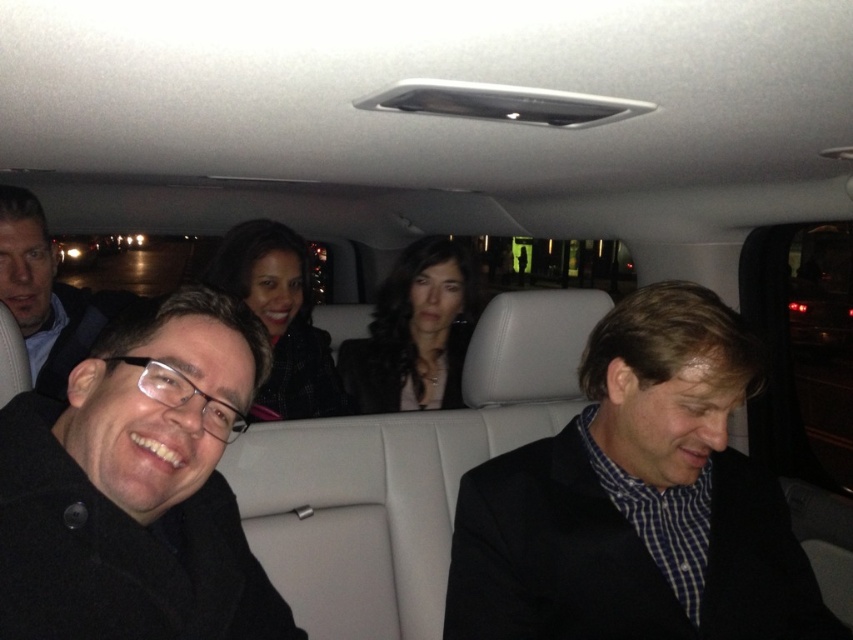
You are a passenger in the limousine and need to retrieve your black matte coat at lower left from under the matte black jacket at center. Can you reach it without disturbing the jacket?

The black matte coat at lower left is located below the matte black jacket at center, so you can reach it without disturbing the jacket.

You are standing in front of the vehicle and want to take a photo of the point at coordinates point (21, 472). The camera has a minimum focus distance of 30 inches. Will the camera be able to focus on that point?

The point at coordinates point (21, 472) is 30.85 inches away from the camera. Since the camera requires a minimum focus distance of 30 inches, the point is just beyond the minimum distance. Therefore, the camera should be able to focus on that point as it is within the acceptable range.

You are a photographer inside the limousine preparing to take a portrait of the passengers. You notice the black matte coat at lower left and the matte black glasses at left. Which object should you avoid placing in the foreground to prevent it from blocking the subject?

You should avoid placing the matte black glasses at left in the foreground because the black matte coat at lower left is positioned under it, meaning the glasses are closer to the camera and would block the subject if placed in front.